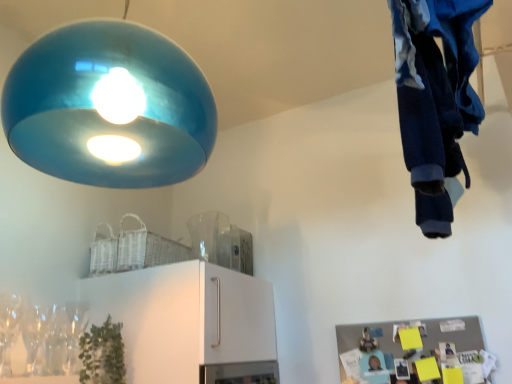
Measure the distance between clear glass wine glass at lower left and camera.

clear glass wine glass at lower left and camera are 4.30 feet apart.

The width and height of the screenshot is (512, 384). I want to click on blue cotton pants at upper right, so click(435, 98).

Image resolution: width=512 pixels, height=384 pixels. I want to click on green matte plant at lower left, so click(102, 354).

Locate an element on the screen. wine glass lying on the left of green matte plant at lower left is located at coordinates (8, 329).

How different are the orientations of green matte plant at lower left and clear glass wine glass at lower left in degrees?

The angle between the facing direction of green matte plant at lower left and the facing direction of clear glass wine glass at lower left is 6.82 degrees.

Is green matte plant at lower left bigger or smaller than clear glass wine glass at lower left?

green matte plant at lower left is bigger than clear glass wine glass at lower left.

From the image's perspective, which object appears higher, blue cotton pants at upper right or green matte plant at lower left?

From the image's view, blue cotton pants at upper right is above.

Between blue cotton pants at upper right and green matte plant at lower left, which one appears on the right side from the viewer's perspective?

From the viewer's perspective, blue cotton pants at upper right appears more on the right side.

Based on the photo, considering their positions, is blue cotton pants at upper right located in front of or behind green matte plant at lower left?

blue cotton pants at upper right is in front of green matte plant at lower left.

Is clear glass wine glass at lower left facing towards blue cotton pants at upper right?

Yes, clear glass wine glass at lower left is aimed at blue cotton pants at upper right.

From a real-world perspective, is clear glass wine glass at lower left on blue cotton pants at upper right?

No.

Identify the location of wine glass located underneath the blue cotton pants at upper right (from a real-world perspective). (8, 329).

Considering the relative sizes of clear glass wine glass at lower left and blue cotton pants at upper right in the image provided, is clear glass wine glass at lower left shorter than blue cotton pants at upper right?

Yes, clear glass wine glass at lower left is shorter than blue cotton pants at upper right.

Does glossy blue lampshade at upper left appear on the left side of green matte plant at lower left?

Incorrect, glossy blue lampshade at upper left is not on the left side of green matte plant at lower left.

Is glossy blue lampshade at upper left aimed at green matte plant at lower left?

No, glossy blue lampshade at upper left is not turned towards green matte plant at lower left.

Does glossy blue lampshade at upper left have a lesser height compared to green matte plant at lower left?

Incorrect, the height of glossy blue lampshade at upper left does not fall short of that of green matte plant at lower left.

From the picture: Does glossy blue lampshade at upper left touch green matte plant at lower left?

No, glossy blue lampshade at upper left is not beside green matte plant at lower left.

Between glossy blue lampshade at upper left and clear glass wine glass at lower left, which one has smaller width?

Thinner between the two is clear glass wine glass at lower left.

Between glossy blue lampshade at upper left and clear glass wine glass at lower left, which one appears on the right side from the viewer's perspective?

glossy blue lampshade at upper left.

From a real-world perspective, does glossy blue lampshade at upper left sit lower than clear glass wine glass at lower left?

No, from a real-world perspective, glossy blue lampshade at upper left is not under clear glass wine glass at lower left.

Is green matte plant at lower left far from blue cotton pants at upper right?

Indeed, green matte plant at lower left is not near blue cotton pants at upper right.

Is green matte plant at lower left not inside blue cotton pants at upper right?

That's correct, green matte plant at lower left is outside of blue cotton pants at upper right.

Is green matte plant at lower left oriented away from blue cotton pants at upper right?

No, blue cotton pants at upper right is not at the back of green matte plant at lower left.

This screenshot has width=512, height=384. I want to click on wine glass that appears below the blue cotton pants at upper right (from the image's perspective), so click(x=8, y=329).

Between blue cotton pants at upper right and clear glass wine glass at lower left, which one has less height?

Standing shorter between the two is clear glass wine glass at lower left.

From a real-world perspective, is blue cotton pants at upper right physically located above or below clear glass wine glass at lower left?

In terms of real-world spatial position, blue cotton pants at upper right is above clear glass wine glass at lower left.

Is blue cotton pants at upper right looking in the opposite direction of clear glass wine glass at lower left?

That's right, blue cotton pants at upper right is facing away from clear glass wine glass at lower left.

I want to click on wine glass in front of the green matte plant at lower left, so [8, 329].

Find the location of a particular element. The height and width of the screenshot is (384, 512). clothing located above the green matte plant at lower left (from a real-world perspective) is located at coordinates (435, 98).

When comparing their distances from green matte plant at lower left, does clear glass wine glass at lower left or blue cotton pants at upper right seem closer?

The object closer to green matte plant at lower left is clear glass wine glass at lower left.

Considering their positions, is glossy blue lampshade at upper left positioned closer to green matte plant at lower left than blue cotton pants at upper right?

glossy blue lampshade at upper left is closer to green matte plant at lower left.

Looking at the image, which one is located closer to glossy blue lampshade at upper left, clear glass wine glass at lower left or green matte plant at lower left?

clear glass wine glass at lower left is positioned closer to the anchor glossy blue lampshade at upper left.

Estimate the real-world distances between objects in this image. Which object is further from blue cotton pants at upper right, clear glass wine glass at lower left or green matte plant at lower left?

Among the two, clear glass wine glass at lower left is located further to blue cotton pants at upper right.

From the image, which object appears to be farther from clear glass wine glass at lower left, glossy blue lampshade at upper left or blue cotton pants at upper right?

Among the two, blue cotton pants at upper right is located further to clear glass wine glass at lower left.

When comparing their distances from clear glass wine glass at lower left, does blue cotton pants at upper right or green matte plant at lower left seem closer?

Based on the image, green matte plant at lower left appears to be nearer to clear glass wine glass at lower left.

Looking at the image, which one is located further to clear glass wine glass at lower left, green matte plant at lower left or blue cotton pants at upper right?

blue cotton pants at upper right.

Looking at the image, which one is located closer to green matte plant at lower left, blue cotton pants at upper right or clear glass wine glass at lower left?

clear glass wine glass at lower left lies closer to green matte plant at lower left than the other object.

Where is `wine glass between glossy blue lampshade at upper left and green matte plant at lower left vertically`? The image size is (512, 384). wine glass between glossy blue lampshade at upper left and green matte plant at lower left vertically is located at coordinates (8, 329).

At what (x,y) coordinates should I click in order to perform the action: click on plant situated between clear glass wine glass at lower left and blue cotton pants at upper right from left to right. Please return your answer as a coordinate pair (x, y). The width and height of the screenshot is (512, 384). Looking at the image, I should click on (102, 354).

Where is `lamp between clear glass wine glass at lower left and blue cotton pants at upper right in the horizontal direction`? Image resolution: width=512 pixels, height=384 pixels. lamp between clear glass wine glass at lower left and blue cotton pants at upper right in the horizontal direction is located at coordinates 109,107.

Where is `lamp situated between green matte plant at lower left and blue cotton pants at upper right from left to right`? The height and width of the screenshot is (384, 512). lamp situated between green matte plant at lower left and blue cotton pants at upper right from left to right is located at coordinates (109, 107).